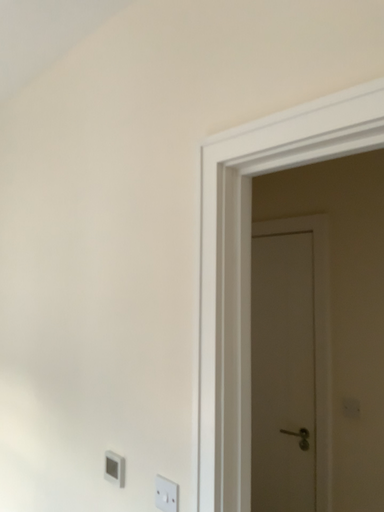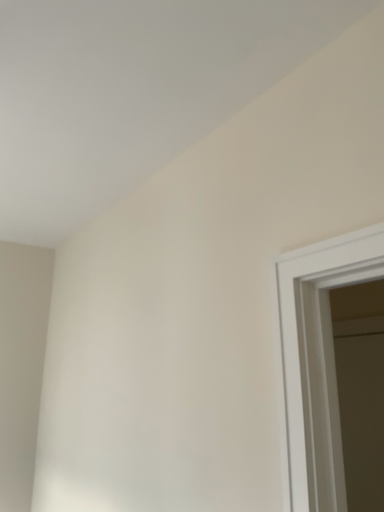
Question: Which way did the camera rotate in the video?

Choices:
 (A) rotated right
 (B) rotated left

Answer: (B)